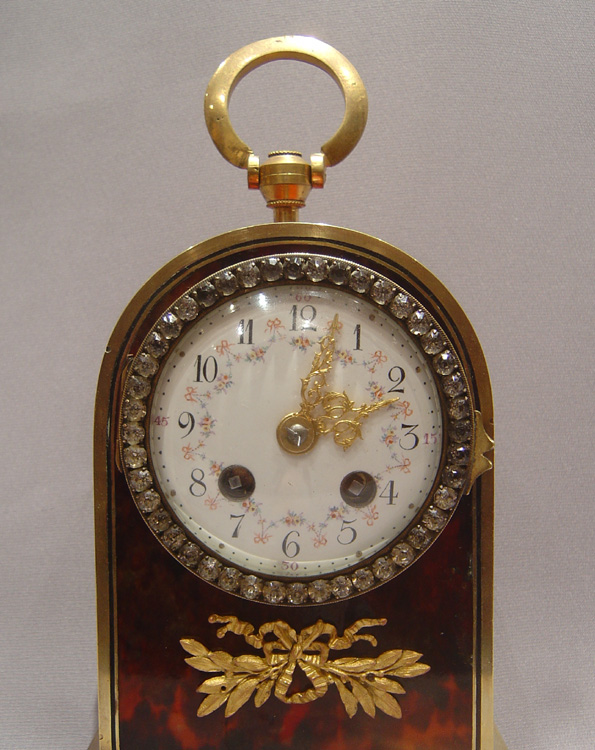
This screenshot has width=595, height=750. I want to click on circles on clock, so click(248, 478), click(363, 481).